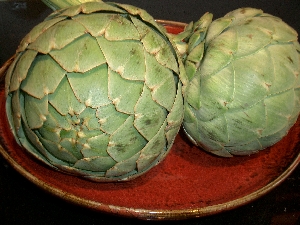
Identify the location of dark spots on plate. The width and height of the screenshot is (300, 225). (168, 204), (180, 203), (196, 201), (207, 198), (254, 177), (283, 160), (292, 154), (284, 166).